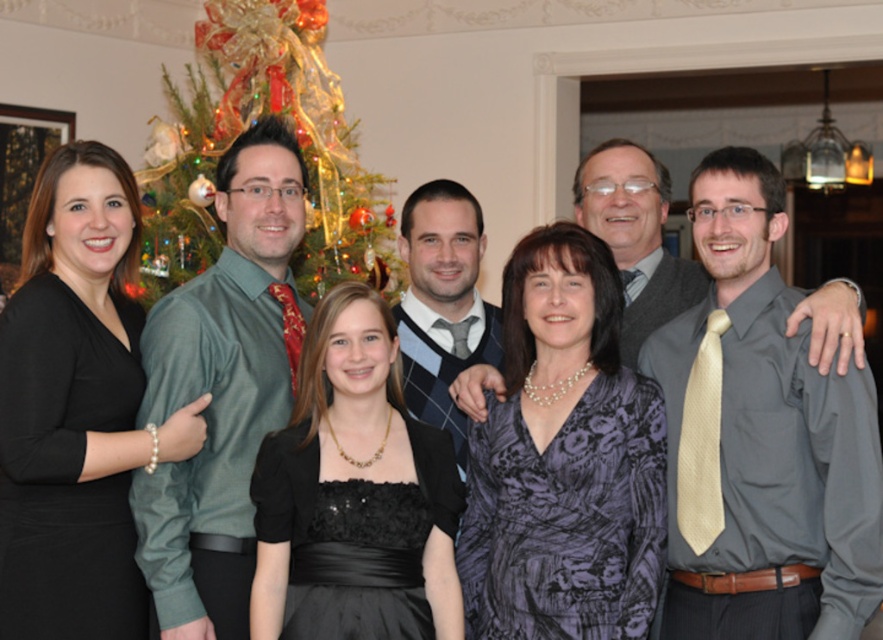
You are standing at the position of point (x=127, y=272) and want to move to the decorated Christmas tree in the background. Is the point (x=698, y=477) blocking your path?

Point (x=698, y=477) is in front of point (x=127, y=272), so yes, it is blocking your path to the Christmas tree in the background.

You are a photographer standing in front of the group to take a photo. You notice two points marked in the image at coordinates point (206,198) and point (688,268). Which point is closer to your camera?

Point (206,198) is closer to the camera than point (688,268) because it is further to the camera than the other point.

You are a photographer standing in front of the decorated christmas tree at upper left and the light gray textured sweater at center. Which object is closer to you?

The decorated christmas tree at upper left is closer to you than the light gray textured sweater at center because it is further to the viewer.